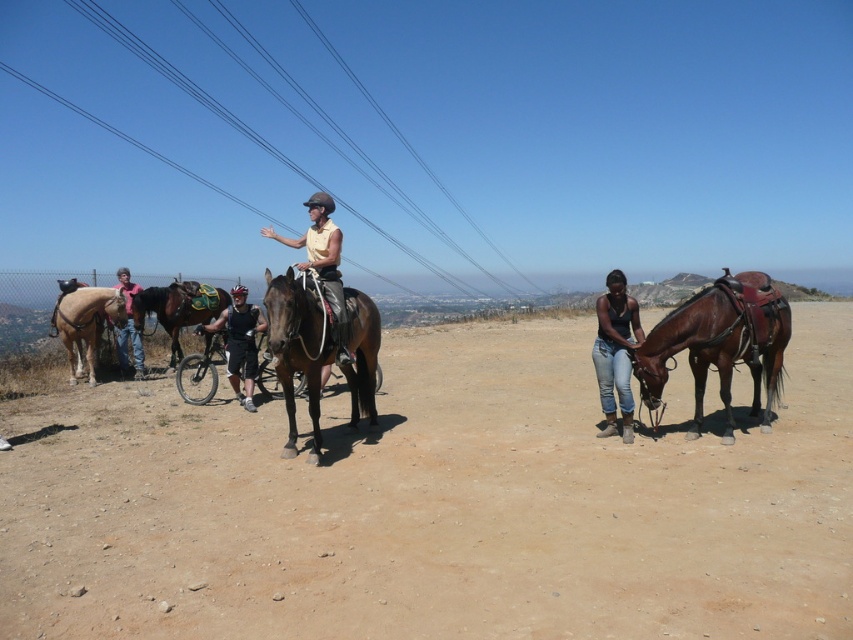
Image resolution: width=853 pixels, height=640 pixels. Describe the element at coordinates (720, 344) in the screenshot. I see `brown leather horse at right` at that location.

Which is behind, point (729, 301) or point (230, 381)?

Positioned behind is point (230, 381).

Identify the location of brown leather horse at right. The height and width of the screenshot is (640, 853). (720, 344).

Looking at this image, is brown sandy dirt at center to the right of light brown leather horse at left from the viewer's perspective?

Yes, brown sandy dirt at center is to the right of light brown leather horse at left.

Can you confirm if brown sandy dirt at center is taller than light brown leather horse at left?

In fact, brown sandy dirt at center may be shorter than light brown leather horse at left.

The width and height of the screenshot is (853, 640). What do you see at coordinates (437, 506) in the screenshot?
I see `brown sandy dirt at center` at bounding box center [437, 506].

The width and height of the screenshot is (853, 640). Find the location of `brown sandy dirt at center`. brown sandy dirt at center is located at coordinates (437, 506).

Which is more to the right, denim jeans at right or light brown leather horse at left?

Positioned to the right is denim jeans at right.

Is denim jeans at right closer to camera compared to light brown leather horse at left?

Yes, denim jeans at right is in front of light brown leather horse at left.

Is point (619, 332) positioned before point (67, 340)?

Yes.

Locate an element on the screen. This screenshot has width=853, height=640. denim jeans at right is located at coordinates (614, 353).